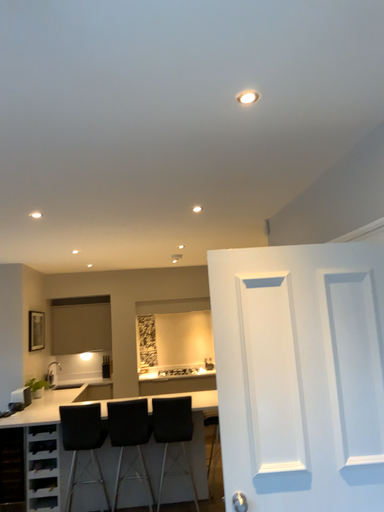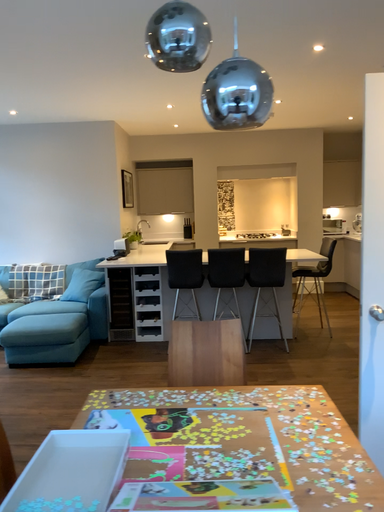
Question: Which way did the camera rotate in the video?

Choices:
 (A) rotated left
 (B) rotated right

Answer: (A)